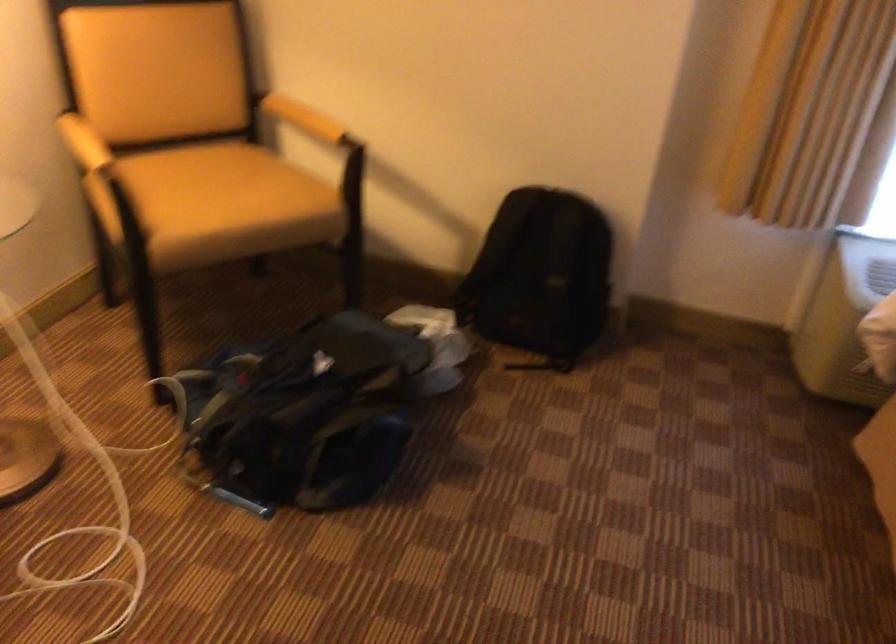
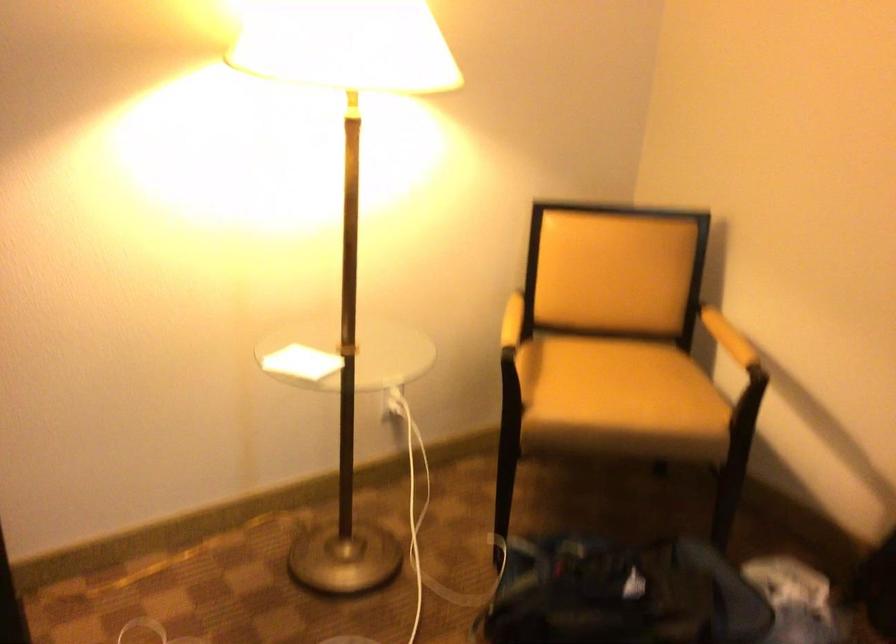
Find the pixel in the second image that matches the point at 237,189 in the first image.

(618, 388)